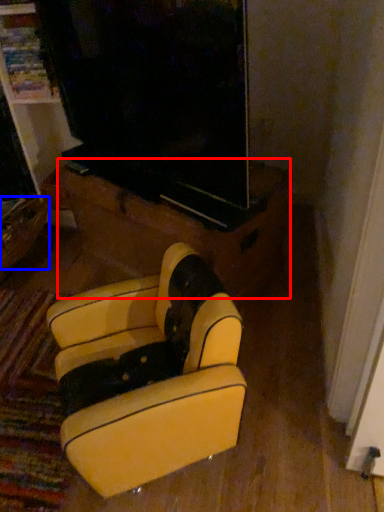
Question: Among these objects, which one is farthest to the camera, furniture (highlighted by a red box) or drawer (highlighted by a blue box)?

Choices:
 (A) furniture
 (B) drawer

Answer: (B)